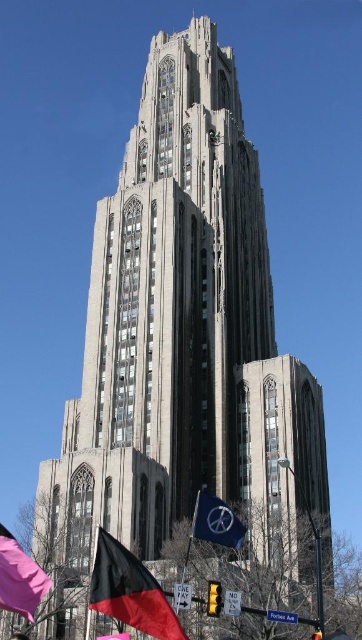
Does black fabric flag at lower left appear over blue fabric flag at lower center?

Indeed, black fabric flag at lower left is positioned over blue fabric flag at lower center.

Does point (148, 572) lie behind point (207, 540)?

No, (148, 572) is in front of (207, 540).

You are a GUI agent. You are given a task and a screenshot of the screen. Output one action in this format:
    pyautogui.click(x=<x>, y=<y>)
    Task: Click on the black fabric flag at lower left
    The height and width of the screenshot is (640, 362).
    Given the screenshot: What is the action you would take?
    pyautogui.click(x=129, y=592)

Is matte pink flag at lower left taller than blue fabric flag at lower center?

Yes, matte pink flag at lower left is taller than blue fabric flag at lower center.

Is point (18, 563) farther from viewer compared to point (225, 516)?

No.

At what (x,y) coordinates should I click in order to perform the action: click on matte pink flag at lower left. Please return your answer as a coordinate pair (x, y). The width and height of the screenshot is (362, 640). Looking at the image, I should click on (19, 577).

Which of these two, black fabric flag at lower left or matte pink flag at lower left, stands taller?

With more height is matte pink flag at lower left.

Does point (90, 596) come in front of point (45, 593)?

No, (90, 596) is further to viewer.

Identify the location of black fabric flag at lower left. Image resolution: width=362 pixels, height=640 pixels. (129, 592).